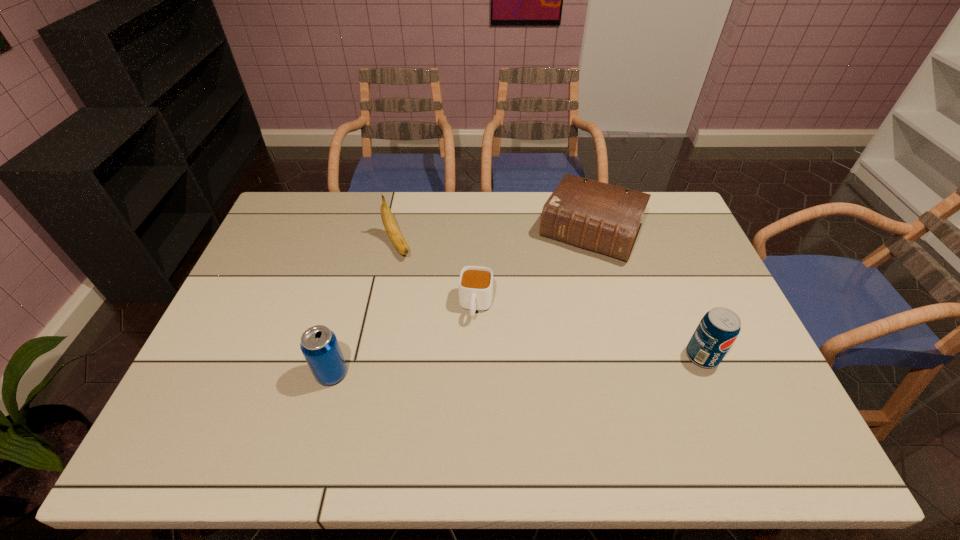
At what (x,y) coordinates should I click in order to perform the action: click on free space between the fourth object from right to left and the leftmost object. Please return your answer as a coordinate pair (x, y). The width and height of the screenshot is (960, 540). Looking at the image, I should click on (364, 309).

You are a GUI agent. You are given a task and a screenshot of the screen. Output one action in this format:
    pyautogui.click(x=<x>, y=<y>)
    Task: Click on the vacant space that is in between the leftmost object and the cup
    
    Given the screenshot: What is the action you would take?
    pyautogui.click(x=404, y=340)

Identify the location of vacant point located between the Bible and the right pop. The image size is (960, 540). (646, 294).

At what (x,y) coordinates should I click in order to perform the action: click on vacant region between the second object from left to right and the second shortest object. Please return your answer as a coordinate pair (x, y). This screenshot has height=540, width=960. Looking at the image, I should click on (494, 239).

At what (x,y) coordinates should I click in order to perform the action: click on unoccupied position between the Bible and the third object from left to right. Please return your answer as a coordinate pair (x, y). Looking at the image, I should click on (534, 269).

Where is `free point between the right pop and the Bible`? free point between the right pop and the Bible is located at coordinates (646, 294).

Where is `free area in between the left pop and the third farthest object`? The width and height of the screenshot is (960, 540). free area in between the left pop and the third farthest object is located at coordinates (404, 340).

Select which object appears as the third closest to the second object from left to right. Please provide its 2D coordinates. Your answer should be formatted as a tuple, i.e. [(x, y)], where the tuple contains the x and y coordinates of a point satisfying the conditions above.

[(596, 216)]

Identify which object is located as the third nearest to the Bible. Please provide its 2D coordinates. Your answer should be formatted as a tuple, i.e. [(x, y)], where the tuple contains the x and y coordinates of a point satisfying the conditions above.

[(390, 225)]

Find the location of a particular element. This screenshot has height=540, width=960. vacant area that satisfies the following two spatial constraints: 1. on the back side of the right pop; 2. on the right side of the leftmost object is located at coordinates (336, 356).